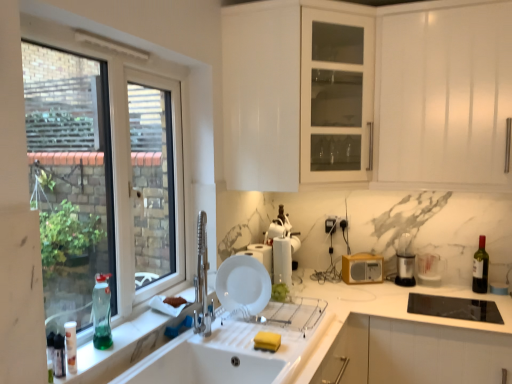
Question: Could you tell me if white ceramic sink at lower center is facing black plastic trash can at right, the 5th appliance when ordered from left to right?

Choices:
 (A) no
 (B) yes

Answer: (A)

Question: Is black plastic trash can at right, marked as the 1th appliance in a right-to-left arrangement, inside white ceramic sink at lower center?

Choices:
 (A) no
 (B) yes

Answer: (A)

Question: Is the position of white ceramic sink at lower center more distant than that of black plastic trash can at right, marked as the 1th appliance in a right-to-left arrangement?

Choices:
 (A) yes
 (B) no

Answer: (B)

Question: Considering the relative sizes of white ceramic sink at lower center and black plastic trash can at right, marked as the 1th appliance in a right-to-left arrangement, in the image provided, is white ceramic sink at lower center thinner than black plastic trash can at right, marked as the 1th appliance in a right-to-left arrangement,?

Choices:
 (A) yes
 (B) no

Answer: (B)

Question: Is white ceramic sink at lower center to the right of black plastic trash can at right, marked as the 1th appliance in a right-to-left arrangement, from the viewer's perspective?

Choices:
 (A) yes
 (B) no

Answer: (B)

Question: From the image's perspective, is white ceramic sink at lower center below black plastic trash can at right, the 5th appliance when ordered from left to right?

Choices:
 (A) yes
 (B) no

Answer: (A)

Question: Is white glossy cabinet at upper center facing towards dark glass bottle at right, the 3th bottle in the front-to-back sequence?

Choices:
 (A) no
 (B) yes

Answer: (A)

Question: From a real-world perspective, is white glossy cabinet at upper center positioned over dark glass bottle at right, which is the first bottle from back to front, based on gravity?

Choices:
 (A) no
 (B) yes

Answer: (B)

Question: Is white glossy cabinet at upper center outside dark glass bottle at right, which is counted as the 1th bottle, starting from the right?

Choices:
 (A) yes
 (B) no

Answer: (A)

Question: Does white glossy cabinet at upper center have a greater width compared to dark glass bottle at right, which is counted as the 1th bottle, starting from the right?

Choices:
 (A) yes
 (B) no

Answer: (A)

Question: Is white glossy cabinet at upper center at the left side of dark glass bottle at right, which is counted as the 1th bottle, starting from the right?

Choices:
 (A) no
 (B) yes

Answer: (B)

Question: Does white glossy cabinet at upper center have a smaller size compared to dark glass bottle at right, the 3th bottle in the front-to-back sequence?

Choices:
 (A) yes
 (B) no

Answer: (B)

Question: Is black plastic trash can at right, the 5th appliance when ordered from left to right, positioned before white plastic container at upper center, the 1th appliance viewed from the left?

Choices:
 (A) yes
 (B) no

Answer: (A)